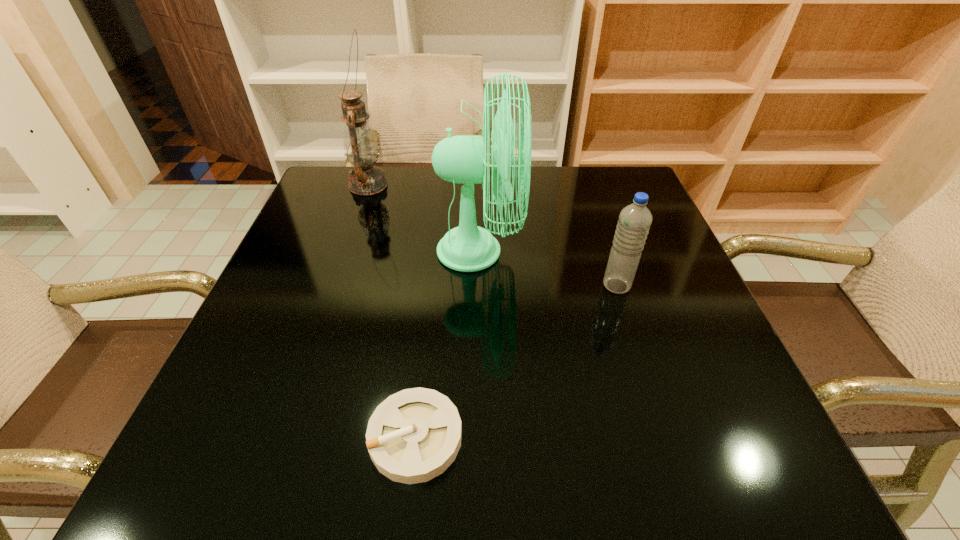
Locate an element on the screen. free spot located on the right of the nearest object is located at coordinates (653, 437).

Identify the location of oil lamp that is at the far edge. (360, 145).

Identify the location of fan present at the far edge. pos(461,159).

You are a GUI agent. You are given a task and a screenshot of the screen. Output one action in this format:
    pyautogui.click(x=<x>, y=<y>)
    Task: Click on the object at the near edge
    The width and height of the screenshot is (960, 540).
    Given the screenshot: What is the action you would take?
    pyautogui.click(x=413, y=436)

This screenshot has height=540, width=960. Identify the location of object present at the left edge. (360, 145).

Where is `object located at the right edge`? Image resolution: width=960 pixels, height=540 pixels. object located at the right edge is located at coordinates (634, 222).

I want to click on object located at the far left corner, so click(x=360, y=145).

This screenshot has width=960, height=540. I want to click on blank area at the far edge, so click(x=574, y=216).

In the image, there is a desktop. At what (x,y) coordinates should I click in order to perform the action: click on vacant space at the near edge. Please return your answer as a coordinate pair (x, y). The width and height of the screenshot is (960, 540). Looking at the image, I should click on (633, 458).

Identify the location of vacant space at the left edge of the desktop. point(287,262).